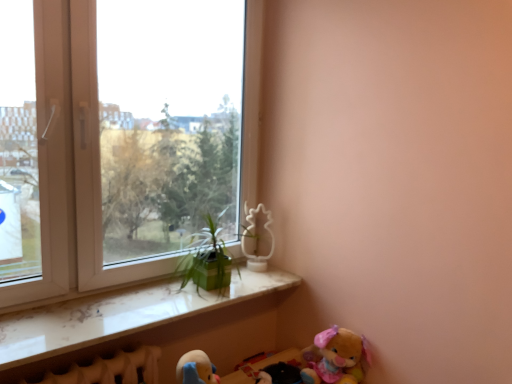
Question: In terms of width, does fluffy plush bear at lower right, the first toy in the front-to-back sequence, look wider or thinner when compared to white matte pineapple at upper center, the 1th toy from the left?

Choices:
 (A) thin
 (B) wide

Answer: (B)

Question: Is point (351, 360) closer or farther from the camera than point (259, 269)?

Choices:
 (A) farther
 (B) closer

Answer: (B)

Question: Estimate the real-world distances between objects in this image. Which object is farther from the white marble window sill at lower left?

Choices:
 (A) green matte plant at center
 (B) white plastic window at upper left
 (C) white matte pineapple at upper center, positioned as the second toy in right-to-left order
 (D) fluffy plush bear at lower right, arranged as the 1th toy when ordered from the bottom

Answer: (D)

Question: Estimate the real-world distances between objects in this image. Which object is closer to the white marble window sill at lower left?

Choices:
 (A) white plastic window at upper left
 (B) green matte plant at center
 (C) fluffy plush bear at lower right, which is the 2th toy in top-to-bottom order
 (D) white matte pineapple at upper center, positioned as the second toy in right-to-left order

Answer: (B)